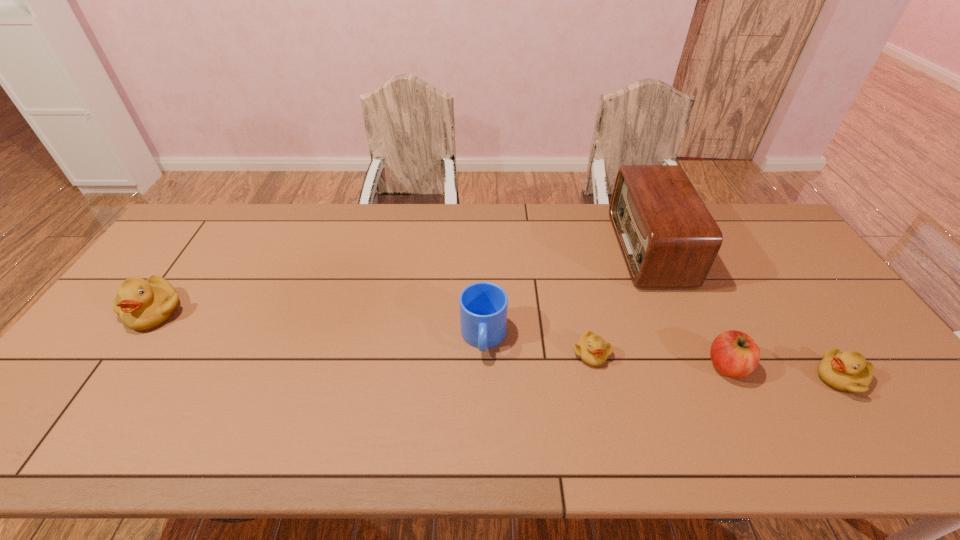
Where is `the second closest duckling to the third object from left to right`? the second closest duckling to the third object from left to right is located at coordinates (142, 304).

This screenshot has height=540, width=960. Find the location of `free space that satisfies the following two spatial constraints: 1. on the front panel of the radio receiver; 2. on the back side of the apple`. free space that satisfies the following two spatial constraints: 1. on the front panel of the radio receiver; 2. on the back side of the apple is located at coordinates (699, 366).

Image resolution: width=960 pixels, height=540 pixels. In order to click on blank area in the image that satisfies the following two spatial constraints: 1. on the front panel of the radio receiver; 2. at the beak of the leftmost object in this screenshot , I will do `click(676, 312)`.

Locate an element on the screen. The width and height of the screenshot is (960, 540). free space that satisfies the following two spatial constraints: 1. on the front panel of the tallest object; 2. on the side of the mug with the handle is located at coordinates (686, 337).

You are a GUI agent. You are given a task and a screenshot of the screen. Output one action in this format:
    pyautogui.click(x=<x>, y=<y>)
    Task: Click on the free space in the image that satisfies the following two spatial constraints: 1. on the front panel of the tallest object; 2. on the side of the mug with the handle
    
    Given the screenshot: What is the action you would take?
    click(686, 337)

Locate an element on the screen. vacant region that satisfies the following two spatial constraints: 1. on the side of the second object from left to right with the handle; 2. on the right side of the apple is located at coordinates (484, 366).

You are a GUI agent. You are given a task and a screenshot of the screen. Output one action in this format:
    pyautogui.click(x=<x>, y=<y>)
    Task: Click on the free location that satisfies the following two spatial constraints: 1. on the front panel of the radio receiver; 2. at the beak of the tallest duckling
    The width and height of the screenshot is (960, 540).
    Given the screenshot: What is the action you would take?
    pyautogui.click(x=676, y=312)

This screenshot has width=960, height=540. I want to click on free region that satisfies the following two spatial constraints: 1. on the front panel of the tallest object; 2. on the back side of the apple, so click(x=699, y=366).

Identify the location of free space that satisfies the following two spatial constraints: 1. on the front panel of the tallest object; 2. at the beak of the fourth object from right to left. Image resolution: width=960 pixels, height=540 pixels. (693, 354).